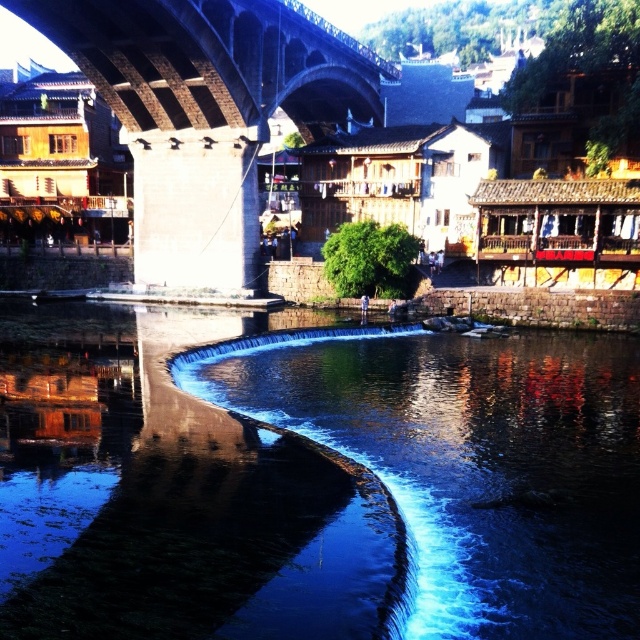
You are a tourist standing on the stone textured arch bridge at center and looking down at the blue smooth water at center. Which direction should you look to see the reflection of the bridge?

The blue smooth water at center is below the stone textured arch bridge at center, so you should look downward to see the reflection of the bridge in the water.

You are standing on the riverside and want to cross to the other side. The stone textured arch bridge at center is too far away. Can you step onto the blue smooth water at center to cross instead?

The blue smooth water at center is shorter than the stone textured arch bridge at center, meaning it is closer to you. However, water is not a solid surface to step on, so you cannot cross by stepping onto the blue smooth water at center. You should use the stone textured arch bridge at center instead.